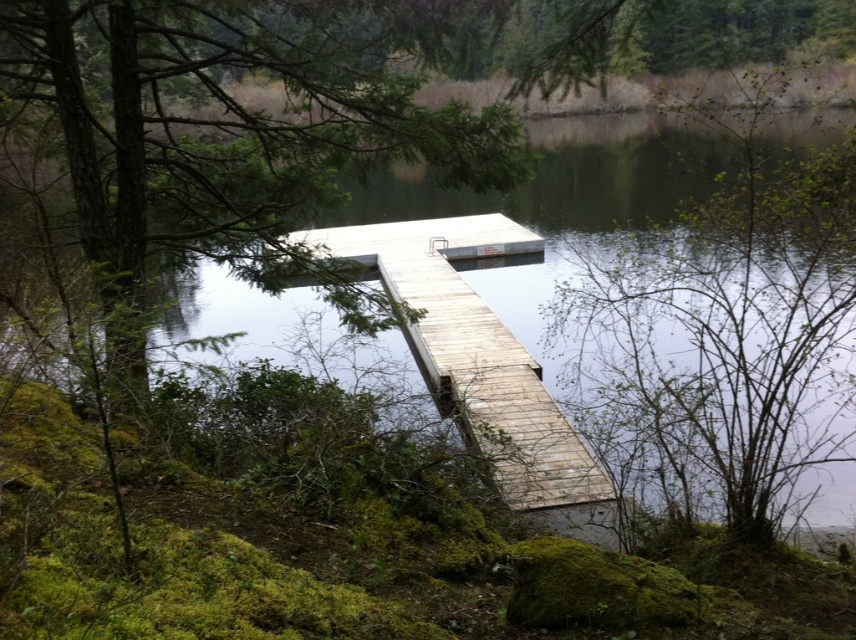
Question: Which point is farther from the camera taking this photo?

Choices:
 (A) (522, 420)
 (B) (813, 506)
 (C) (795, 349)

Answer: (A)

Question: Can you confirm if green leafy tree at upper right is positioned to the right of wooden dock at center?

Choices:
 (A) yes
 (B) no

Answer: (A)

Question: Which object is positioned farthest from the green leafy tree at upper right?

Choices:
 (A) wooden dock at center
 (B) transparent water at center

Answer: (A)

Question: Which point is closer to the camera?

Choices:
 (A) (440, 316)
 (B) (212, 310)
 (C) (551, 330)

Answer: (C)

Question: Observing the image, what is the correct spatial positioning of green leafy tree at upper right in reference to wooden dock at center?

Choices:
 (A) right
 (B) left

Answer: (A)

Question: Can you confirm if green leafy tree at upper right is thinner than transparent water at center?

Choices:
 (A) no
 (B) yes

Answer: (B)